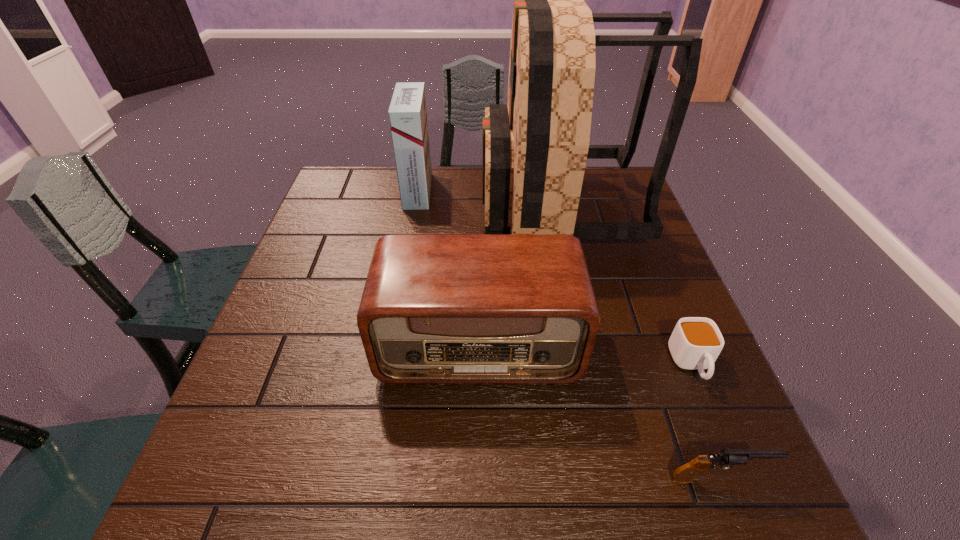
This screenshot has height=540, width=960. Identify the location of vacant space located on the front panel of the third shortest object. (479, 435).

I want to click on vacant space positioned 0.110m on the side with the handle of the shortest object, so click(x=726, y=446).

The height and width of the screenshot is (540, 960). Identify the location of backpack at the far edge. (535, 147).

This screenshot has width=960, height=540. I want to click on cigarette case present at the far edge, so click(x=407, y=113).

At what (x,y) coordinates should I click in order to perform the action: click on object that is at the near edge. Please return your answer as a coordinate pair (x, y). The width and height of the screenshot is (960, 540). Looking at the image, I should click on (686, 473).

Where is `backpack that is positioned at the right edge`? backpack that is positioned at the right edge is located at coordinates click(x=535, y=147).

I want to click on gun at the right edge, so click(686, 473).

Identify the location of cup located in the right edge section of the desktop. Image resolution: width=960 pixels, height=540 pixels. (695, 343).

Locate an element on the screen. Image resolution: width=960 pixels, height=540 pixels. object that is at the far right corner is located at coordinates (535, 147).

Identify the location of object present at the near right corner. (686, 473).